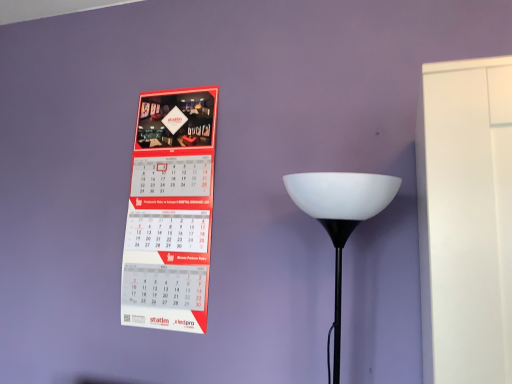
Describe the element at coordinates (170, 211) in the screenshot. Image resolution: width=512 pixels, height=384 pixels. I see `red matte calendar at center` at that location.

The height and width of the screenshot is (384, 512). What are the coordinates of `red matte calendar at center` in the screenshot? It's located at (170, 211).

Measure the distance between point [156,245] and camera.

They are 1.43 meters apart.

Find the location of a particular element. The height and width of the screenshot is (384, 512). red matte calendar at center is located at coordinates (170, 211).